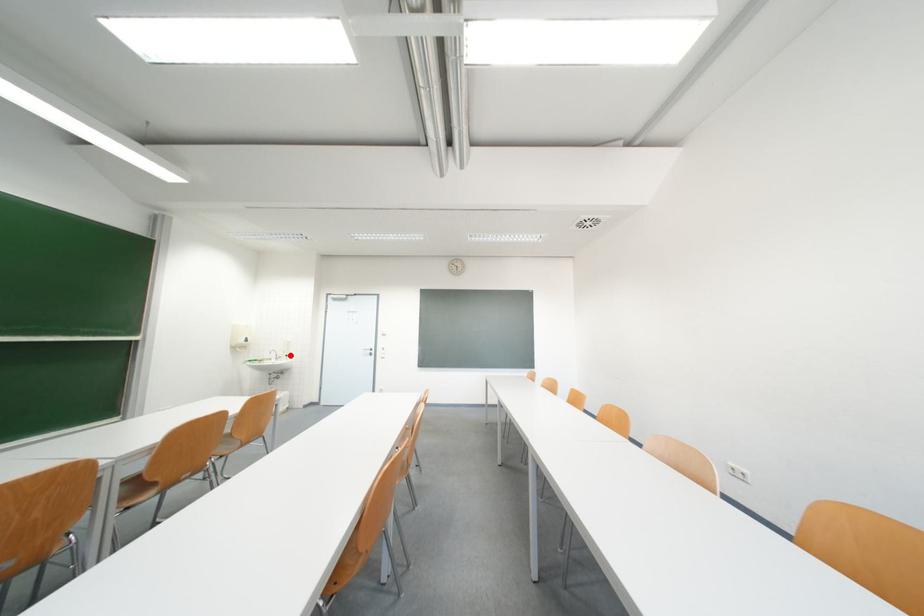
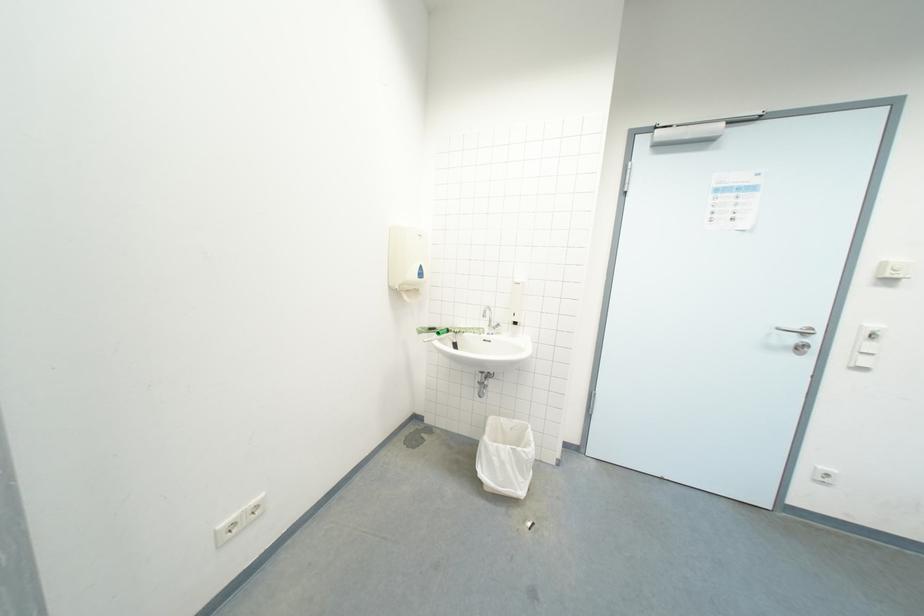
Where in the second image is the point corresponding to the highlighted location from the first image?

(511, 318)